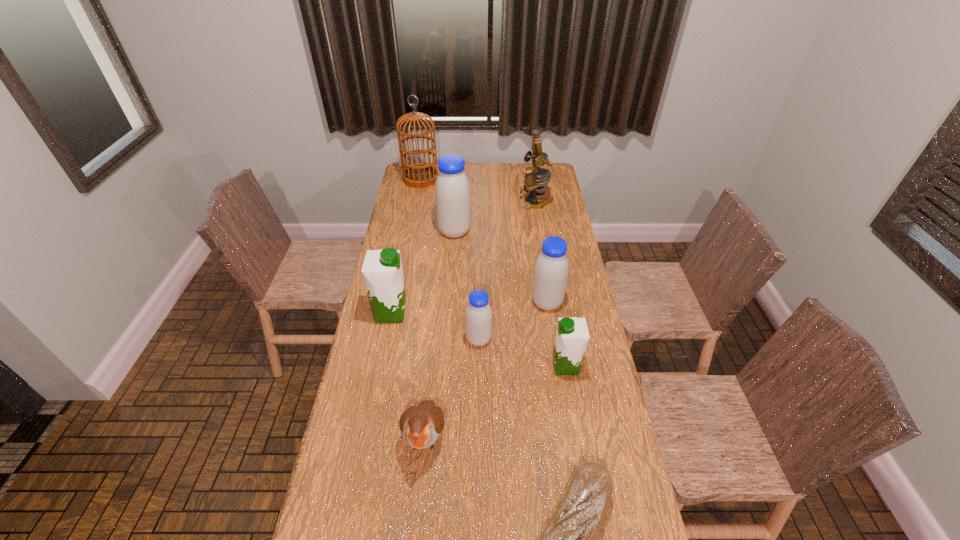
The height and width of the screenshot is (540, 960). What are the coordinates of `birdcage` in the screenshot? It's located at (418, 175).

The height and width of the screenshot is (540, 960). What are the coordinates of `microscope` in the screenshot? It's located at (534, 185).

The height and width of the screenshot is (540, 960). I want to click on the tallest soya milk, so click(452, 189).

Where is `the farthest blue soya milk`? the farthest blue soya milk is located at coordinates (x=452, y=189).

Image resolution: width=960 pixels, height=540 pixels. I want to click on the bigger green soya milk, so click(382, 272).

Image resolution: width=960 pixels, height=540 pixels. What are the coordinates of `the leftmost soya milk` in the screenshot? It's located at (382, 272).

Locate an element on the screen. This screenshot has height=540, width=960. the second smallest blue soya milk is located at coordinates (551, 270).

The height and width of the screenshot is (540, 960). Find the location of `the second nearest blue soya milk`. the second nearest blue soya milk is located at coordinates (551, 270).

Image resolution: width=960 pixels, height=540 pixels. In order to click on the right green soya milk in this screenshot , I will do `click(572, 335)`.

Find the location of a particular element. The width and height of the screenshot is (960, 540). the smaller green soya milk is located at coordinates (572, 335).